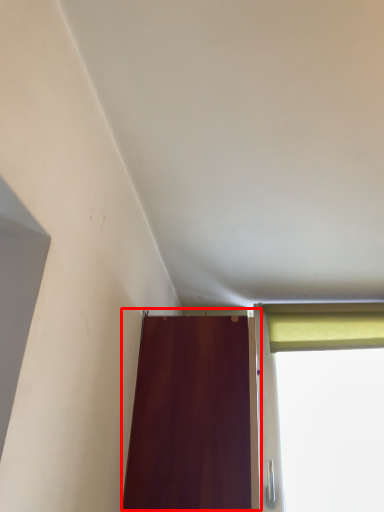
Question: From the image's perspective, what is the correct spatial positioning of door (annotated by the red box) in reference to curtain?

Choices:
 (A) below
 (B) above

Answer: (A)